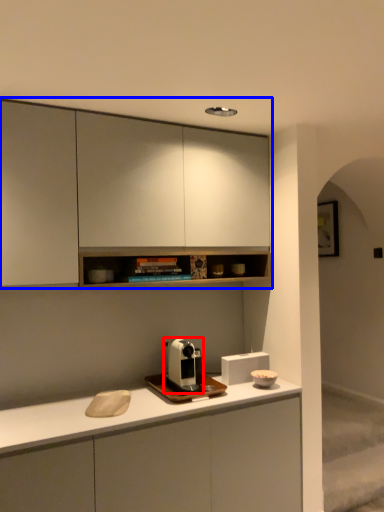
Question: Which of the following is the farthest to the observer, coffee machine (highlighted by a red box) or cabinetry (highlighted by a blue box)?

Choices:
 (A) coffee machine
 (B) cabinetry

Answer: (A)